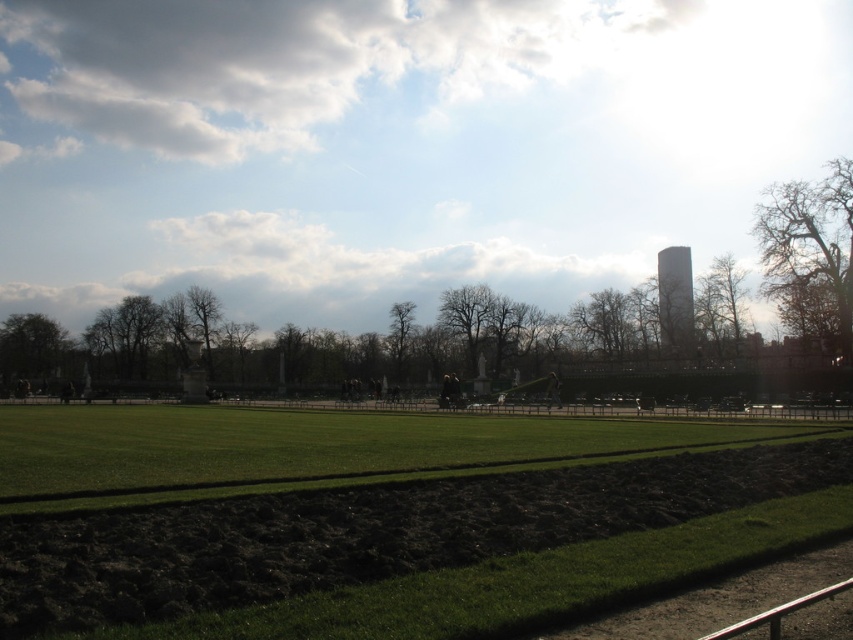
Question: Which object appears farthest from the camera in this image?

Choices:
 (A) green grass at center
 (B) bright white sky at upper center

Answer: (B)

Question: Does bright white sky at upper center have a smaller size compared to bare branches at upper right?

Choices:
 (A) yes
 (B) no

Answer: (B)

Question: Can you confirm if bright white sky at upper center is thinner than bare branches at upper right?

Choices:
 (A) yes
 (B) no

Answer: (B)

Question: Which of the following is the closest to the observer?

Choices:
 (A) bare branches at center
 (B) bare branches at upper right

Answer: (B)

Question: Which of these objects is positioned closest to the metallic silver rail at lower right?

Choices:
 (A) bare branches at center
 (B) bare branches at upper right
 (C) green grass at center

Answer: (C)

Question: Can you confirm if bare branches at upper right is positioned above metallic silver rail at lower right?

Choices:
 (A) no
 (B) yes

Answer: (B)